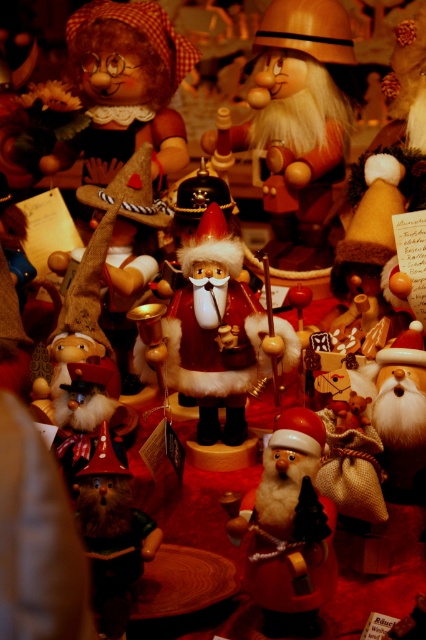
You are a photographer trying to capture the Santa Claus figure in the center of the image. You notice two points marked in the scene, point 1 at coordinates point (327, 522) and point 2 at coordinates point (135, 563). Which point is closer to the camera and thus better suited for focusing on the Santa Claus figure?

Point (327, 522) is closer to the camera than point (135, 563), so it is better suited for focusing on the Santa Claus figure.

In the Christmas display, there are a fuzzy red santa at center and a wooden gnome at center. Which one is positioned to the right side?

The fuzzy red santa at center is positioned to the right of the wooden gnome at center.